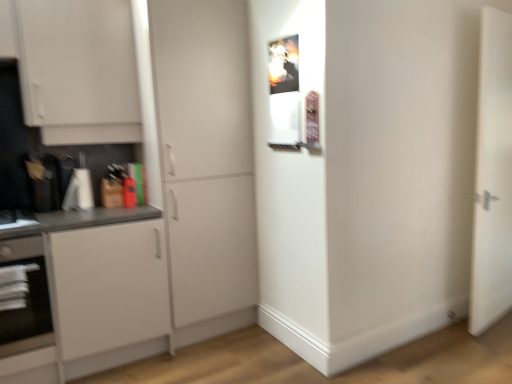
Question: Relative to white matte cabinet at center, marked as the 1th door in a left-to-right arrangement, is black glass oven at lower left in front or behind?

Choices:
 (A) front
 (B) behind

Answer: (A)

Question: From their relative heights in the image, would you say black glass oven at lower left is taller or shorter than white matte cabinet at center, arranged as the 2th door when viewed from the right?

Choices:
 (A) tall
 (B) short

Answer: (B)

Question: Estimate the real-world distances between objects in this image. Which object is farther from the white matte door at right, which appears as the 2th door when viewed from the left?

Choices:
 (A) white matte cabinet at left
 (B) black glass oven at lower left
 (C) white matte cabinet at center, arranged as the 2th door when viewed from the right

Answer: (B)

Question: Based on their relative distances, which object is nearer to the black glass oven at lower left?

Choices:
 (A) white matte cabinet at left
 (B) white matte cabinet at center, marked as the 1th door in a left-to-right arrangement
 (C) white matte door at right, which appears as the 2th door when viewed from the left

Answer: (A)